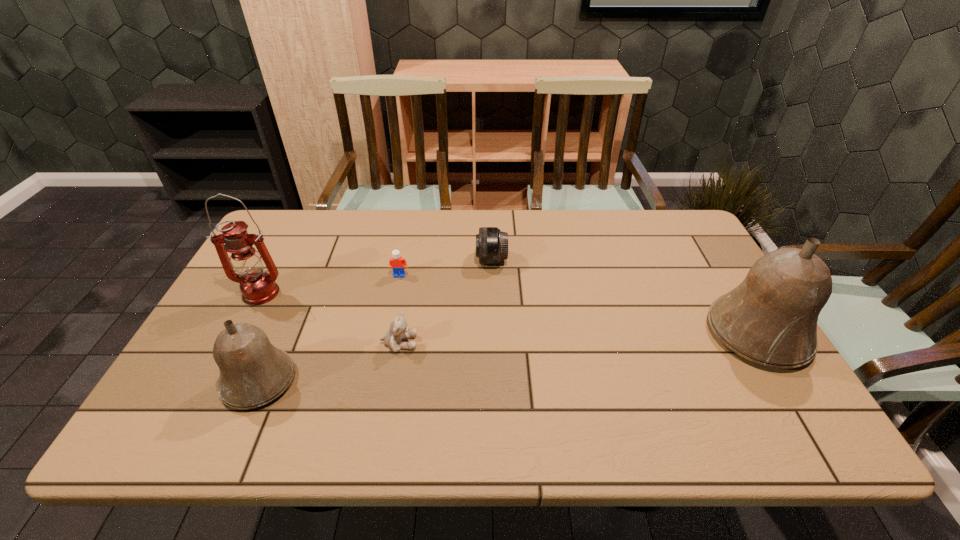
You are a GUI agent. You are given a task and a screenshot of the screen. Output one action in this format:
    pyautogui.click(x=<x>, y=<y>)
    Task: Click on the vacant space that satisfies the following two spatial constraints: 1. on the face of the taller bell; 2. on the right side of the second farthest object
    The height and width of the screenshot is (540, 960).
    Given the screenshot: What is the action you would take?
    pyautogui.click(x=388, y=334)

The height and width of the screenshot is (540, 960). Find the location of `vacant region that satisfies the following two spatial constraints: 1. on the front-facing side of the telephoto lens; 2. on the face of the second farthest object`. vacant region that satisfies the following two spatial constraints: 1. on the front-facing side of the telephoto lens; 2. on the face of the second farthest object is located at coordinates (492, 275).

At what (x,y) coordinates should I click in order to perform the action: click on vacant region that satisfies the following two spatial constraints: 1. on the front-facing side of the taller bell; 2. on the left side of the farthest object. Please return your answer as a coordinate pair (x, y). Looking at the image, I should click on (493, 334).

At what (x,y) coordinates should I click in order to perform the action: click on free location that satisfies the following two spatial constraints: 1. on the front side of the oil lamp; 2. on the right side of the taller bell. Please return your answer as a coordinate pair (x, y). The image size is (960, 540). Looking at the image, I should click on (239, 334).